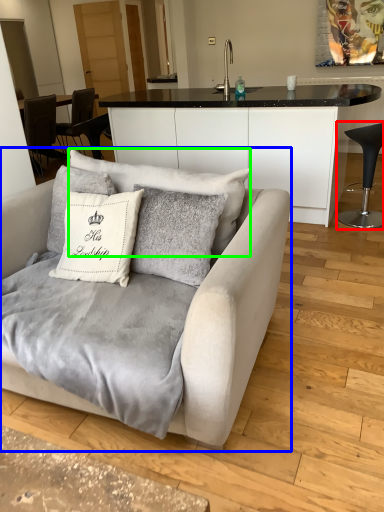
Question: Based on their relative distances, which object is nearer to chair (highlighted by a red box)? Choose from studio couch (highlighted by a blue box) and pillow (highlighted by a green box).

Choices:
 (A) studio couch
 (B) pillow

Answer: (B)